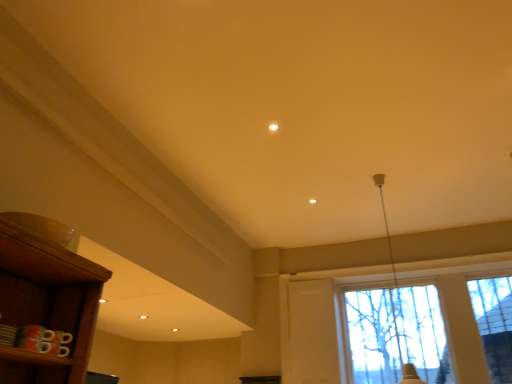
Question: From the image's perspective, relative to white glossy lampshade at upper right, is transparent glass window at center above or below?

Choices:
 (A) below
 (B) above

Answer: (A)

Question: From a real-world perspective, is transparent glass window at center physically located above or below white glossy lampshade at upper right?

Choices:
 (A) above
 (B) below

Answer: (B)

Question: Is point (451, 296) closer or farther from the camera than point (385, 218)?

Choices:
 (A) closer
 (B) farther

Answer: (B)

Question: Considering the positions of white glossy lampshade at upper right and transparent glass window at center in the image, is white glossy lampshade at upper right bigger or smaller than transparent glass window at center?

Choices:
 (A) small
 (B) big

Answer: (B)

Question: Would you say white glossy lampshade at upper right is to the left or to the right of transparent glass window at center in the picture?

Choices:
 (A) right
 (B) left

Answer: (B)

Question: Considering the positions of point (411, 380) and point (453, 317), is point (411, 380) closer or farther from the camera than point (453, 317)?

Choices:
 (A) closer
 (B) farther

Answer: (B)

Question: Is white glossy lampshade at upper right situated inside transparent glass window at center or outside?

Choices:
 (A) inside
 (B) outside

Answer: (B)